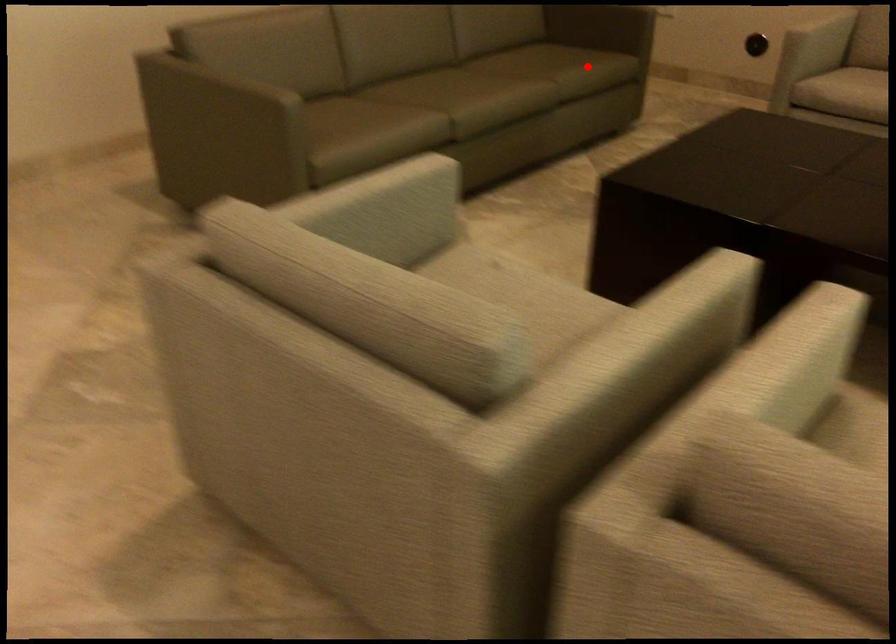
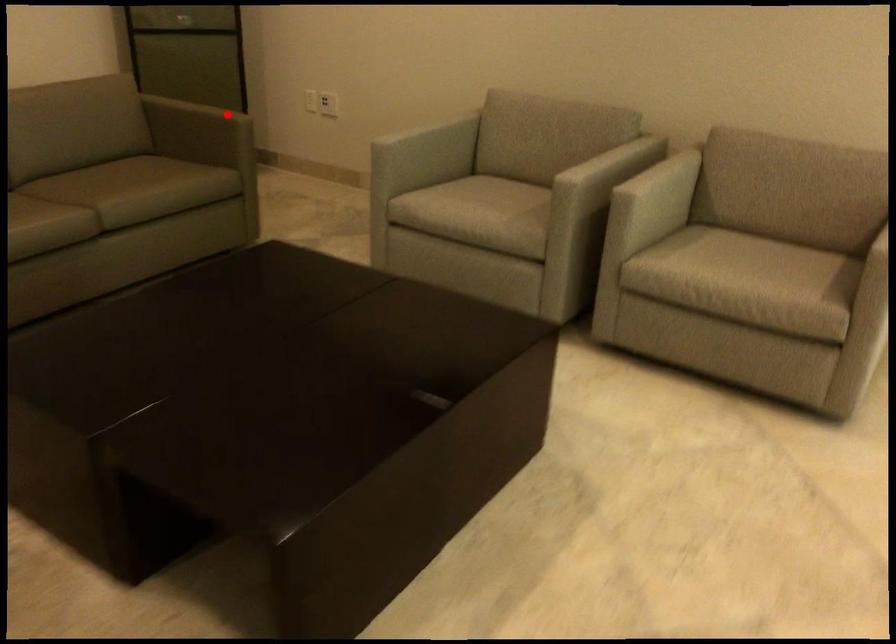
I am providing you with two images of the same scene from different viewpoints. A red point is marked on the first image and another point is marked on the second image. Are the points marked in image1 and image2 representing the same 3D position?

No